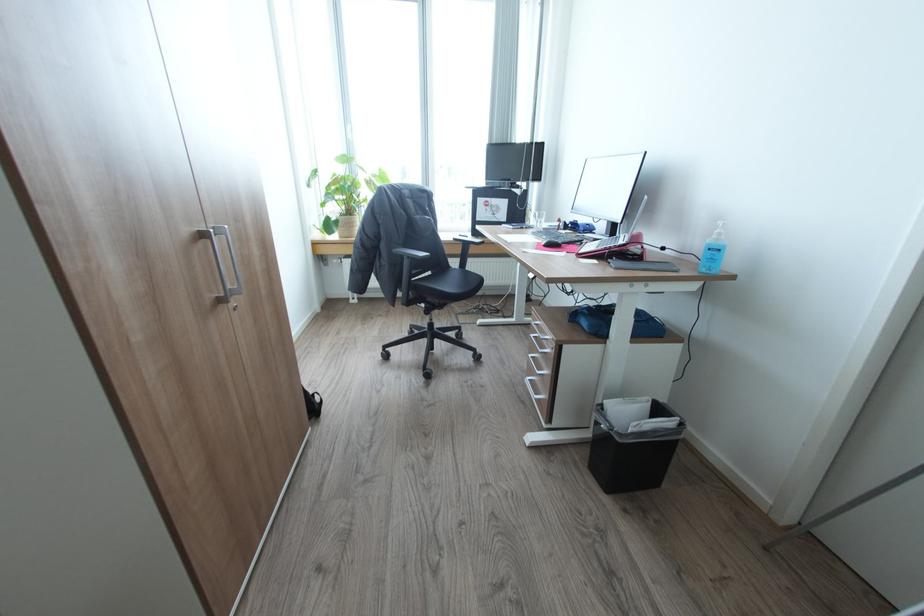
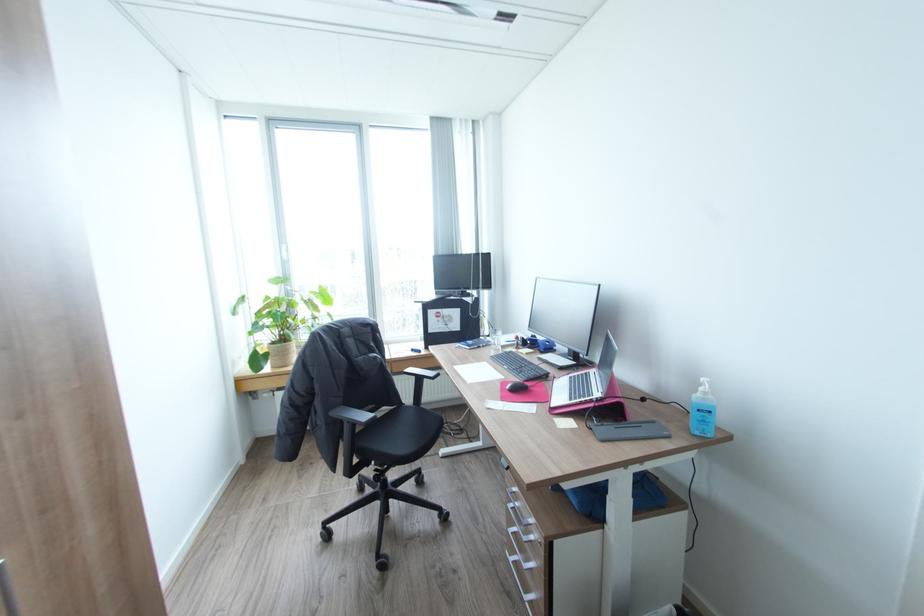
Find the pixel in the second image that matches (723,233) in the first image.

(710, 392)